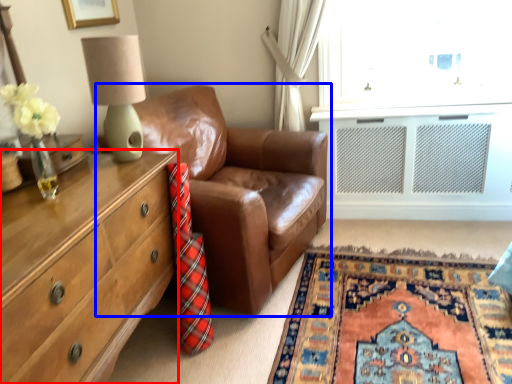
Question: Which point is further to the camera, chest of drawers (highlighted by a red box) or studio couch (highlighted by a blue box)?

Choices:
 (A) chest of drawers
 (B) studio couch

Answer: (B)